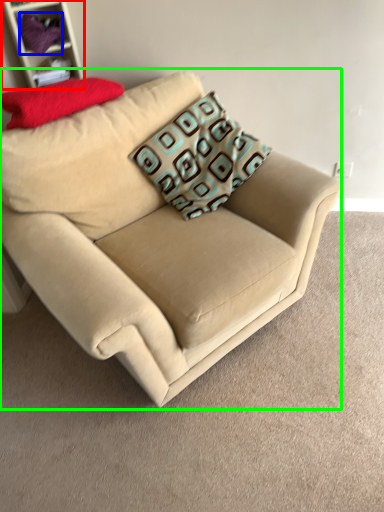
Question: Considering the real-world distances, which object is closest to shelf (highlighted by a red box)? fabric (highlighted by a blue box) or studio couch (highlighted by a green box).

Choices:
 (A) fabric
 (B) studio couch

Answer: (A)